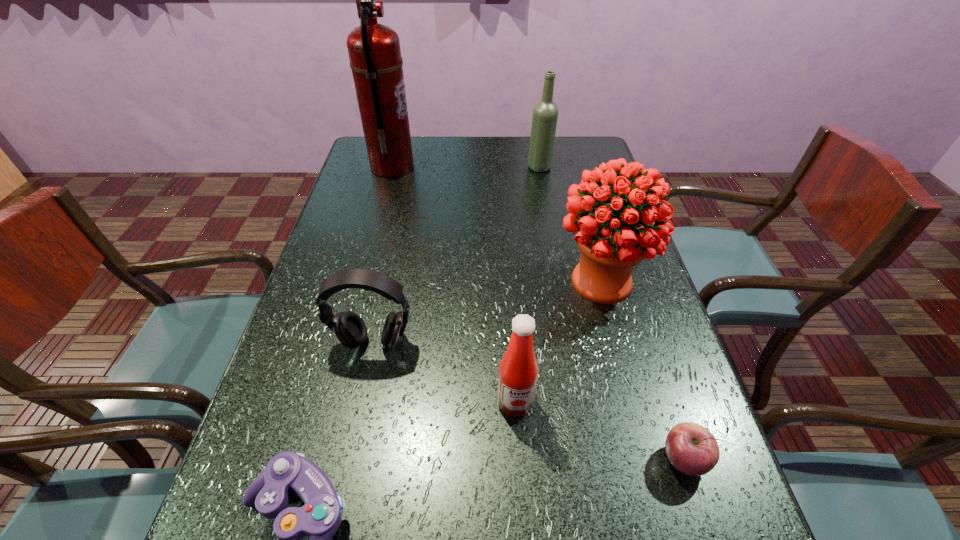
I want to click on object that is at the far left corner, so click(x=374, y=51).

At what (x,y) coordinates should I click in order to perform the action: click on free region at the left edge of the desktop. Please return your answer as a coordinate pair (x, y). Looking at the image, I should click on (284, 345).

I want to click on vacant space at the right edge of the desktop, so click(642, 393).

Where is `free space at the far right corner of the desktop`? This screenshot has width=960, height=540. free space at the far right corner of the desktop is located at coordinates (587, 158).

Identify the location of vacant area that lies between the tallest object and the fourth nearest object. (383, 254).

At what (x,y) coordinates should I click in order to perform the action: click on vacant region between the fourth tallest object and the apple. Please return your answer as a coordinate pair (x, y). Image resolution: width=960 pixels, height=540 pixels. Looking at the image, I should click on (599, 431).

Find the location of a particular element. This screenshot has height=540, width=960. free point between the fourth object from left to right and the apple is located at coordinates (599, 431).

Image resolution: width=960 pixels, height=540 pixels. Find the location of `vacant space in between the earphone and the fourth tallest object`. vacant space in between the earphone and the fourth tallest object is located at coordinates (444, 372).

Identify the location of free spot between the fifth nearest object and the fourth object from right to left. (558, 342).

The width and height of the screenshot is (960, 540). Find the location of `vacant point located between the sixth tallest object and the fire extinguisher`. vacant point located between the sixth tallest object and the fire extinguisher is located at coordinates (538, 314).